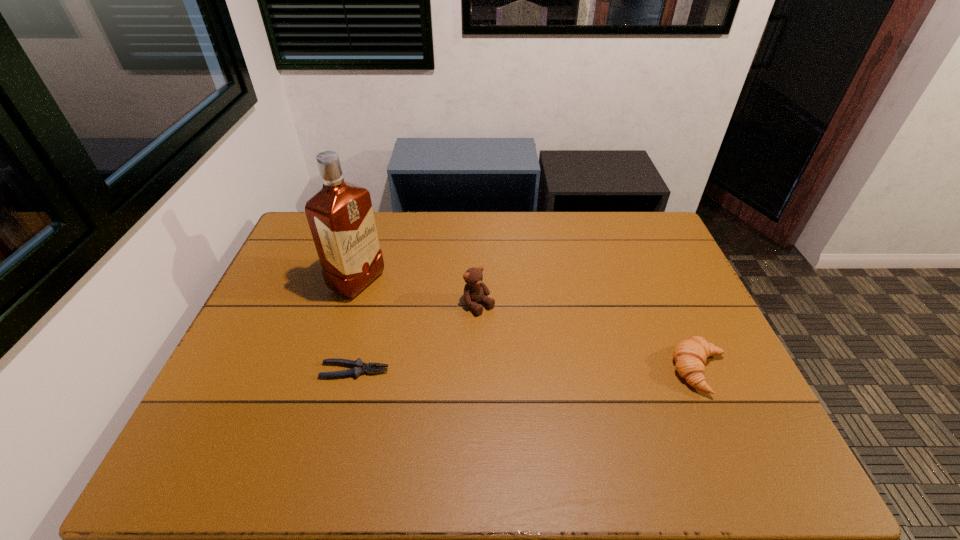
Where is `empty location between the rightmost object and the pliers`? The image size is (960, 540). empty location between the rightmost object and the pliers is located at coordinates (527, 370).

You are a GUI agent. You are given a task and a screenshot of the screen. Output one action in this format:
    pyautogui.click(x=<x>, y=<y>)
    Task: Click on the empty space that is in between the shortest object and the teddy bear
    The image size is (960, 540).
    Given the screenshot: What is the action you would take?
    click(x=417, y=338)

Locate an element on the screen. The image size is (960, 540). vacant space in between the liquor and the second tallest object is located at coordinates (419, 294).

Identify which object is the closest to the second tallest object. Please provide its 2D coordinates. Your answer should be formatted as a tuple, i.e. [(x, y)], where the tuple contains the x and y coordinates of a point satisfying the conditions above.

[(359, 367)]

Identify which object is located as the nearest to the third shortest object. Please provide its 2D coordinates. Your answer should be formatted as a tuple, i.e. [(x, y)], where the tuple contains the x and y coordinates of a point satisfying the conditions above.

[(359, 367)]

I want to click on vacant space that satisfies the following two spatial constraints: 1. on the front side of the tallest object; 2. at the gripping part of the shortest object, so click(330, 370).

Find the location of `blank area in the image that satisfies the following two spatial constraints: 1. on the front side of the liquor; 2. at the gripping part of the shortest object`. blank area in the image that satisfies the following two spatial constraints: 1. on the front side of the liquor; 2. at the gripping part of the shortest object is located at coordinates (330, 370).